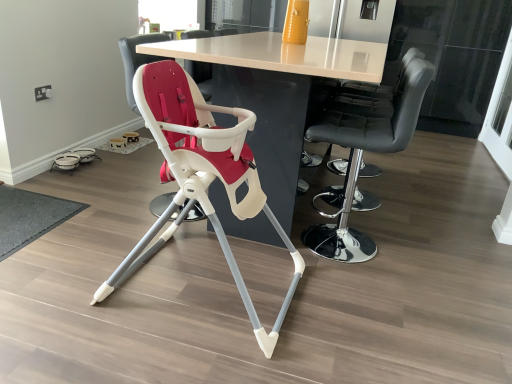
Question: Does matte plastic highchair at center, the second chair viewed from the left, come in front of white plastic highchair at center, the 1th chair when ordered from left to right?

Choices:
 (A) yes
 (B) no

Answer: (A)

Question: Can you confirm if matte plastic highchair at center, the second chair viewed from the left, is positioned to the right of white plastic highchair at center, the 1th chair when ordered from left to right?

Choices:
 (A) no
 (B) yes

Answer: (B)

Question: Is white plastic highchair at center, arranged as the 3th chair when viewed from the right, a part of matte plastic highchair at center, the second chair viewed from the left?

Choices:
 (A) yes
 (B) no

Answer: (B)

Question: Can you confirm if matte plastic highchair at center, positioned as the 2th chair in right-to-left order, is taller than white plastic highchair at center, the 1th chair when ordered from left to right?

Choices:
 (A) yes
 (B) no

Answer: (B)

Question: Is white plastic highchair at center, the 1th chair when ordered from left to right, at the back of matte plastic highchair at center, positioned as the 2th chair in right-to-left order?

Choices:
 (A) no
 (B) yes

Answer: (A)

Question: Considering the positions of point (334, 213) and point (303, 84), is point (334, 213) closer or farther from the camera than point (303, 84)?

Choices:
 (A) closer
 (B) farther

Answer: (B)

Question: Considering their positions, is black leather bar stool at right, marked as the third chair in a left-to-right arrangement, located in front of or behind white glossy table at center?

Choices:
 (A) behind
 (B) front

Answer: (A)

Question: From a real-world perspective, is black leather bar stool at right, positioned as the first chair in right-to-left order, positioned above or below white glossy table at center?

Choices:
 (A) below
 (B) above

Answer: (B)

Question: Visually, is black leather bar stool at right, positioned as the first chair in right-to-left order, positioned to the left or to the right of white glossy table at center?

Choices:
 (A) left
 (B) right

Answer: (B)

Question: Considering the positions of point (152, 56) and point (350, 231), is point (152, 56) closer or farther from the camera than point (350, 231)?

Choices:
 (A) closer
 (B) farther

Answer: (A)

Question: From the image's perspective, is white plastic highchair at center, arranged as the 3th chair when viewed from the right, above or below black leather bar stool at right, positioned as the first chair in right-to-left order?

Choices:
 (A) below
 (B) above

Answer: (B)

Question: Is white plastic highchair at center, the 1th chair when ordered from left to right, inside or outside of black leather bar stool at right, positioned as the first chair in right-to-left order?

Choices:
 (A) outside
 (B) inside

Answer: (A)

Question: Is white plastic highchair at center, the 1th chair when ordered from left to right, bigger or smaller than black leather bar stool at right, marked as the third chair in a left-to-right arrangement?

Choices:
 (A) big
 (B) small

Answer: (B)

Question: Is white glossy table at center inside or outside of transparent glass screen door at upper right?

Choices:
 (A) inside
 (B) outside

Answer: (B)

Question: From a real-world perspective, is white glossy table at center above or below transparent glass screen door at upper right?

Choices:
 (A) below
 (B) above

Answer: (A)